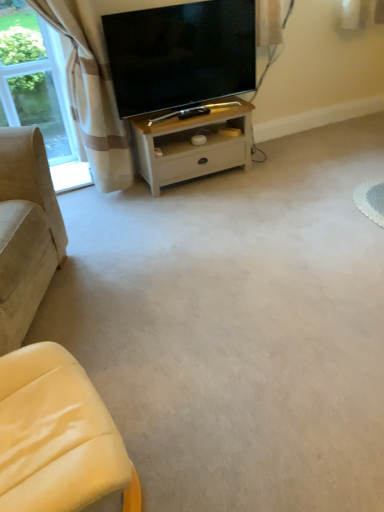
The width and height of the screenshot is (384, 512). I want to click on blank space situated above matte black tv at upper center (from a real-world perspective), so click(x=180, y=7).